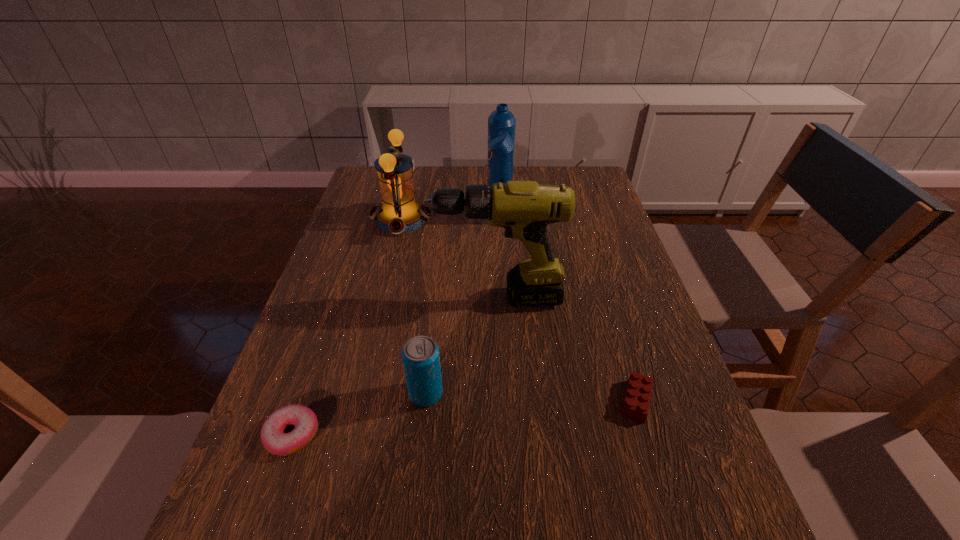
Image resolution: width=960 pixels, height=540 pixels. Identify the location of vacant region at the far left corner of the desktop. pos(368,187).

What are the coordinates of `free space between the rightmost object and the shampoo` in the screenshot? It's located at (567, 312).

The width and height of the screenshot is (960, 540). Identify the location of unoccupied area between the fourth tallest object and the rightmost object. (531, 397).

You are a GUI agent. You are given a task and a screenshot of the screen. Output one action in this format:
    pyautogui.click(x=<x>, y=<y>)
    Task: Click on the unoccupied position between the shampoo and the lantern
    
    Given the screenshot: What is the action you would take?
    pyautogui.click(x=450, y=220)

You are a GUI agent. You are given a task and a screenshot of the screen. Output one action in this format:
    pyautogui.click(x=<x>, y=<y>)
    Task: Click on the free point between the drill and the lantern
    
    Given the screenshot: What is the action you would take?
    pyautogui.click(x=449, y=259)

You are a GUI agent. You are given a task and a screenshot of the screen. Output one action in this format:
    pyautogui.click(x=<x>, y=<y>)
    Task: Click on the blank region between the lantern and the rightmost object
    
    Given the screenshot: What is the action you would take?
    pyautogui.click(x=518, y=310)

Where is `free point between the fourth tallest object and the doughnut`? free point between the fourth tallest object and the doughnut is located at coordinates (359, 414).

Where is `vacant point located between the third shortest object and the lantern`? This screenshot has height=540, width=960. vacant point located between the third shortest object and the lantern is located at coordinates (414, 306).

Identify the location of unoccupied position between the soda can and the lantern. The height and width of the screenshot is (540, 960). pyautogui.click(x=414, y=306).

Find the location of a particular element. Image resolution: width=960 pixels, height=540 pixels. free spot between the fourth shortest object and the Lego is located at coordinates (518, 310).